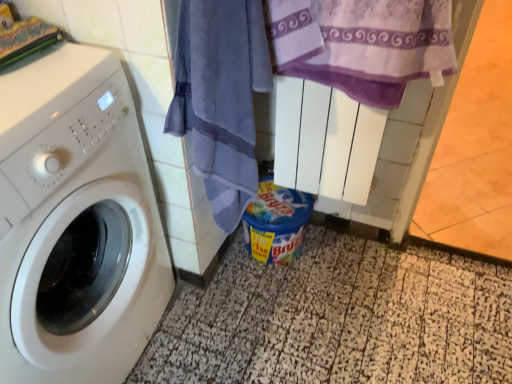
Question: Are blue plastic container at lower center and purple textured towel at upper right, the second beach towel from the left, beside each other?

Choices:
 (A) yes
 (B) no

Answer: (B)

Question: From a real-world perspective, is blue plastic container at lower center located higher than purple textured towel at upper right, the second beach towel from the left?

Choices:
 (A) no
 (B) yes

Answer: (A)

Question: Is blue plastic container at lower center positioned in front of purple textured towel at upper right, which is counted as the first beach towel, starting from the right?

Choices:
 (A) no
 (B) yes

Answer: (A)

Question: Is blue plastic container at lower center not within purple textured towel at upper right, the second beach towel from the left?

Choices:
 (A) yes
 (B) no

Answer: (A)

Question: Does blue plastic container at lower center have a smaller size compared to purple textured towel at upper right, which is counted as the first beach towel, starting from the right?

Choices:
 (A) yes
 (B) no

Answer: (A)

Question: Is blue plastic container at lower center aimed at purple textured towel at upper right, the second beach towel from the left?

Choices:
 (A) yes
 (B) no

Answer: (B)

Question: From the image's perspective, is speckled tile at lower center above blue cotton towel at center, the first beach towel from the left?

Choices:
 (A) no
 (B) yes

Answer: (A)

Question: Is speckled tile at lower center at the right side of blue cotton towel at center, which is counted as the second beach towel, starting from the right?

Choices:
 (A) yes
 (B) no

Answer: (A)

Question: Can you confirm if speckled tile at lower center is taller than blue cotton towel at center, the first beach towel from the left?

Choices:
 (A) yes
 (B) no

Answer: (B)

Question: Is speckled tile at lower center positioned beyond the bounds of blue cotton towel at center, which is counted as the second beach towel, starting from the right?

Choices:
 (A) no
 (B) yes

Answer: (B)

Question: Is blue cotton towel at center, which is counted as the second beach towel, starting from the right, located within speckled tile at lower center?

Choices:
 (A) yes
 (B) no

Answer: (B)

Question: Does speckled tile at lower center have a lesser width compared to blue cotton towel at center, the first beach towel from the left?

Choices:
 (A) yes
 (B) no

Answer: (B)

Question: Is purple textured towel at upper right, the second beach towel from the left, smaller than white glossy washing machine at left?

Choices:
 (A) no
 (B) yes

Answer: (B)